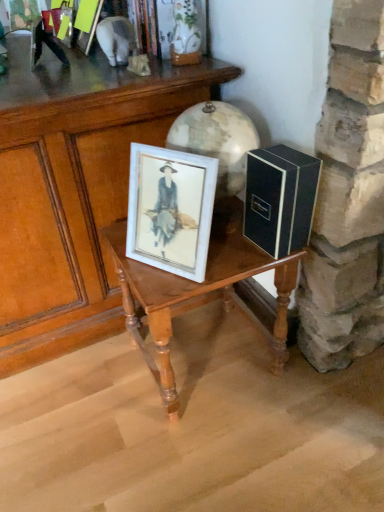
Question: Does point (41, 35) appear closer or farther from the camera than point (281, 262)?

Choices:
 (A) closer
 (B) farther

Answer: (B)

Question: From the image's perspective, is metallic silver figurine at upper left positioned above or below wooden table at center, which ranks as the 2th table in left-to-right order?

Choices:
 (A) above
 (B) below

Answer: (A)

Question: Based on their relative distances, which object is nearer to the wooden table at center, marked as the first table in a right-to-left arrangement?

Choices:
 (A) wooden table at center, which is the second table in right-to-left order
 (B) white matte picture frame at center
 (C) black matte box at right
 (D) metallic silver figurine at upper left

Answer: (B)

Question: Which object is the closest to the wooden table at center, marked as the first table in a right-to-left arrangement?

Choices:
 (A) metallic silver figurine at upper left
 (B) wooden table at center, which is the second table in right-to-left order
 (C) black matte box at right
 (D) white matte picture frame at center

Answer: (D)